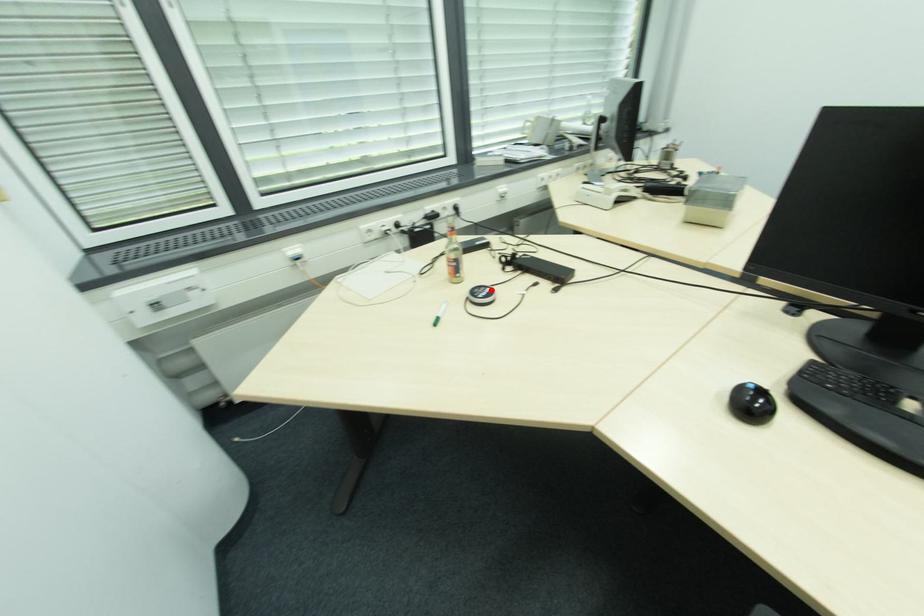
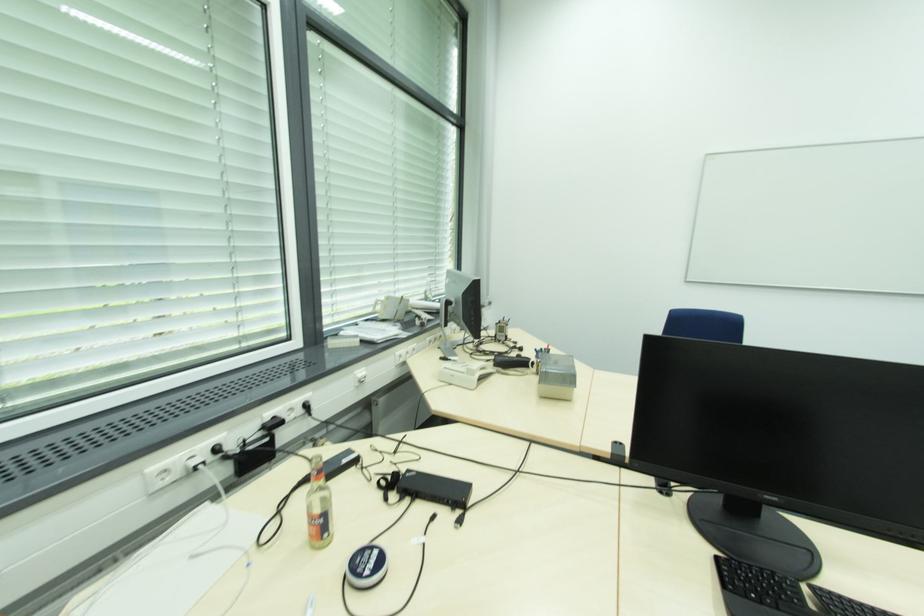
The point at the highlighted location is marked in the first image. Where is the corresponding point in the second image?

(379, 552)